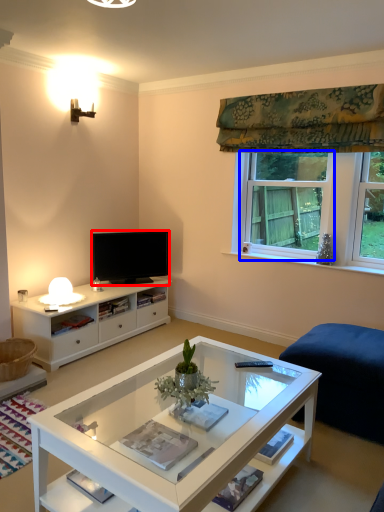
Question: Which point is closer to the camera, television (highlighted by a red box) or window (highlighted by a blue box)?

Choices:
 (A) television
 (B) window

Answer: (B)